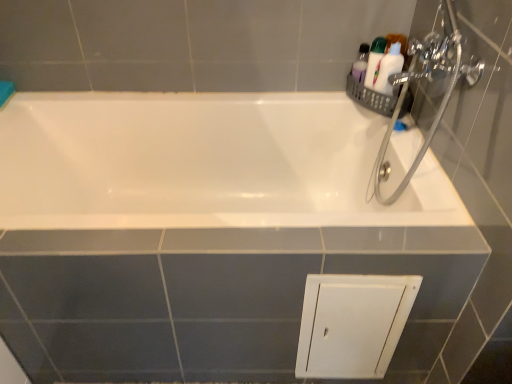
This screenshot has height=384, width=512. I want to click on white plastic bottle at upper right, the 2th toiletry positioned from the left, so click(384, 62).

Can you tell me how much white plastic bottle at upper right, the 2th toiletry positioned from the left, and chrome metallic showerhead at upper right differ in facing direction?

The facing directions of white plastic bottle at upper right, the 2th toiletry positioned from the left, and chrome metallic showerhead at upper right are 73.3 degrees apart.

Is white plastic bottle at upper right, arranged as the first toiletry when viewed from the right, to the right of chrome metallic showerhead at upper right from the viewer's perspective?

Yes.

I want to click on toiletry that is the 1st object located above the chrome metallic showerhead at upper right (from the image's perspective), so click(x=384, y=62).

Looking at this image, in the image, is white plastic bottle at upper right, arranged as the first toiletry when viewed from the right, positioned in front of or behind chrome metallic showerhead at upper right?

white plastic bottle at upper right, arranged as the first toiletry when viewed from the right, is positioned farther from the viewer than chrome metallic showerhead at upper right.

This screenshot has height=384, width=512. I want to click on toiletry on the left side of white plastic bottle at upper right, the 2th toiletry positioned from the left, so click(374, 61).

From a real-world perspective, is white plastic bottle at upper right, arranged as the first toiletry when viewed from the right, located higher than white glossy toiletries at upper right, acting as the 2th toiletry starting from the right?

Indeed, from a real-world perspective, white plastic bottle at upper right, arranged as the first toiletry when viewed from the right, stands above white glossy toiletries at upper right, acting as the 2th toiletry starting from the right.

Considering the points (378, 73) and (370, 52), which point is behind, point (378, 73) or point (370, 52)?

Positioned behind is point (370, 52).

Considering the relative sizes of white glossy toiletries at upper right, the 1th toiletry in the left-to-right sequence, and chrome metallic showerhead at upper right in the image provided, is white glossy toiletries at upper right, the 1th toiletry in the left-to-right sequence, taller than chrome metallic showerhead at upper right?

No.

From a real-world perspective, which object rests below the other?

white glossy toiletries at upper right, acting as the 2th toiletry starting from the right, is physically lower.

Is white glossy toiletries at upper right, the 1th toiletry in the left-to-right sequence, directly adjacent to chrome metallic showerhead at upper right?

No, white glossy toiletries at upper right, the 1th toiletry in the left-to-right sequence, is not touching chrome metallic showerhead at upper right.

Do you think white glossy toiletries at upper right, acting as the 2th toiletry starting from the right, is within chrome metallic showerhead at upper right, or outside of it?

white glossy toiletries at upper right, acting as the 2th toiletry starting from the right, is spatially situated outside chrome metallic showerhead at upper right.

From the picture: Is white plastic bottle at upper right, the 2th toiletry positioned from the left, completely or partially inside white glossy toiletries at upper right, acting as the 2th toiletry starting from the right?

Actually, white plastic bottle at upper right, the 2th toiletry positioned from the left, is outside white glossy toiletries at upper right, acting as the 2th toiletry starting from the right.

Find the location of a particular element. The image size is (512, 384). toiletry above the white plastic bottle at upper right, the 2th toiletry positioned from the left (from the image's perspective) is located at coordinates pyautogui.click(x=374, y=61).

Which of these two, white glossy toiletries at upper right, acting as the 2th toiletry starting from the right, or white plastic bottle at upper right, arranged as the first toiletry when viewed from the right, is thinner?

With smaller width is white plastic bottle at upper right, arranged as the first toiletry when viewed from the right.

Based on the photo, is white glossy toiletries at upper right, the 1th toiletry in the left-to-right sequence, positioned far away from white plastic bottle at upper right, arranged as the first toiletry when viewed from the right?

No.

Who is taller, chrome metallic showerhead at upper right or white glossy toiletries at upper right, acting as the 2th toiletry starting from the right?

With more height is chrome metallic showerhead at upper right.

Is chrome metallic showerhead at upper right to the right of white glossy toiletries at upper right, acting as the 2th toiletry starting from the right, from the viewer's perspective?

Correct, you'll find chrome metallic showerhead at upper right to the right of white glossy toiletries at upper right, acting as the 2th toiletry starting from the right.

At what (x,y) coordinates should I click in order to perform the action: click on toiletry on the left of chrome metallic showerhead at upper right. Please return your answer as a coordinate pair (x, y). The image size is (512, 384). Looking at the image, I should click on point(374,61).

Is chrome metallic showerhead at upper right far away from white glossy toiletries at upper right, the 1th toiletry in the left-to-right sequence?

No.

Can you tell me how much chrome metallic showerhead at upper right and white plastic bottle at upper right, arranged as the first toiletry when viewed from the right, differ in facing direction?

chrome metallic showerhead at upper right and white plastic bottle at upper right, arranged as the first toiletry when viewed from the right, are facing 73.3 degrees away from each other.

Considering the relative sizes of chrome metallic showerhead at upper right and white plastic bottle at upper right, the 2th toiletry positioned from the left, in the image provided, is chrome metallic showerhead at upper right shorter than white plastic bottle at upper right, the 2th toiletry positioned from the left,?

No.

Is point (424, 74) positioned behind point (396, 41)?

No.

Could you tell me if chrome metallic showerhead at upper right is facing white plastic bottle at upper right, arranged as the first toiletry when viewed from the right?

No, chrome metallic showerhead at upper right is not turned towards white plastic bottle at upper right, arranged as the first toiletry when viewed from the right.

You are a GUI agent. You are given a task and a screenshot of the screen. Output one action in this format:
    pyautogui.click(x=<x>, y=<y>)
    Task: Click on the plumbing fixture in front of the white plastic bottle at upper right, arranged as the first toiletry when viewed from the right
    
    Given the screenshot: What is the action you would take?
    pyautogui.click(x=429, y=79)

Find the location of a particular element. This screenshot has width=512, height=384. toiletry behind the white plastic bottle at upper right, the 2th toiletry positioned from the left is located at coordinates (374, 61).

Based on their spatial positions, is white plastic bottle at upper right, the 2th toiletry positioned from the left, or chrome metallic showerhead at upper right closer to white glossy toiletries at upper right, acting as the 2th toiletry starting from the right?

white plastic bottle at upper right, the 2th toiletry positioned from the left.

From the image, which object appears to be nearer to white plastic bottle at upper right, the 2th toiletry positioned from the left, white glossy toiletries at upper right, acting as the 2th toiletry starting from the right, or chrome metallic showerhead at upper right?

white glossy toiletries at upper right, acting as the 2th toiletry starting from the right, is positioned closer to the anchor white plastic bottle at upper right, the 2th toiletry positioned from the left.

From the image, which object appears to be farther from white glossy toiletries at upper right, acting as the 2th toiletry starting from the right, chrome metallic showerhead at upper right or white plastic bottle at upper right, the 2th toiletry positioned from the left?

Based on the image, chrome metallic showerhead at upper right appears to be further to white glossy toiletries at upper right, acting as the 2th toiletry starting from the right.

Which object lies further to the anchor point white plastic bottle at upper right, the 2th toiletry positioned from the left, chrome metallic showerhead at upper right or white glossy toiletries at upper right, the 1th toiletry in the left-to-right sequence?

The object further to white plastic bottle at upper right, the 2th toiletry positioned from the left, is chrome metallic showerhead at upper right.

Based on their spatial positions, is white plastic bottle at upper right, arranged as the first toiletry when viewed from the right, or white glossy toiletries at upper right, acting as the 2th toiletry starting from the right, further from chrome metallic showerhead at upper right?

Based on the image, white glossy toiletries at upper right, acting as the 2th toiletry starting from the right, appears to be further to chrome metallic showerhead at upper right.

Estimate the real-world distances between objects in this image. Which object is further from chrome metallic showerhead at upper right, white glossy toiletries at upper right, the 1th toiletry in the left-to-right sequence, or white plastic bottle at upper right, arranged as the first toiletry when viewed from the right?

white glossy toiletries at upper right, the 1th toiletry in the left-to-right sequence.

Identify the location of toiletry positioned between chrome metallic showerhead at upper right and white glossy toiletries at upper right, the 1th toiletry in the left-to-right sequence, from near to far. Image resolution: width=512 pixels, height=384 pixels. (384, 62).